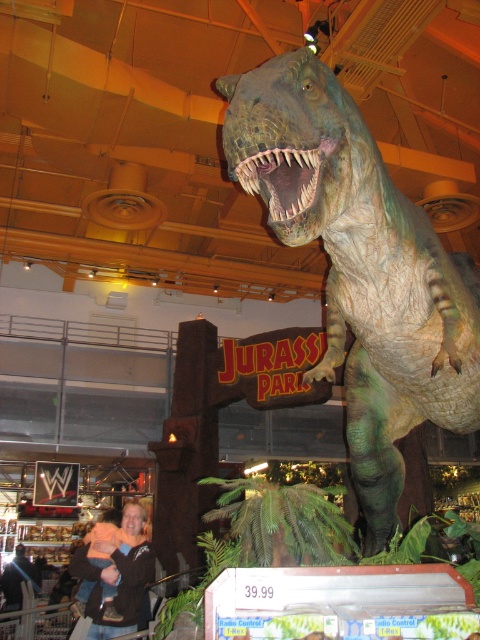
You are a customer in a Jurassic Park themed store. You want to take a photo of the green textured dinosaur at center while keeping the dark brown leather jacket at lower left visible in the frame. Can you stand close enough to the dinosaur to do this?

The distance between the green textured dinosaur at center and the dark brown leather jacket at lower left is 8.95 feet. Since this distance is relatively large, you can stand close to the dinosaur while still keeping the jacket in the frame as long as your camera has a wide enough angle or you adjust your position accordingly.

You are a customer in a store and you see the green textured dinosaur at center and the dark brown leather jacket at lower left. Which item is closer to the entrance of the store?

The dark brown leather jacket at lower left is closer to the entrance because it is positioned to the left of the green textured dinosaur at center, which is further away from the entrance.

You are standing in a store and see the green textured dinosaur at center. If you want to take a photo of it from the front, where should you position yourself relative to the dinosaur?

Since the green textured dinosaur at center is located at point (359, 268), you should position yourself directly in front of it, facing the front side of the dinosaur to capture the best frontal view.